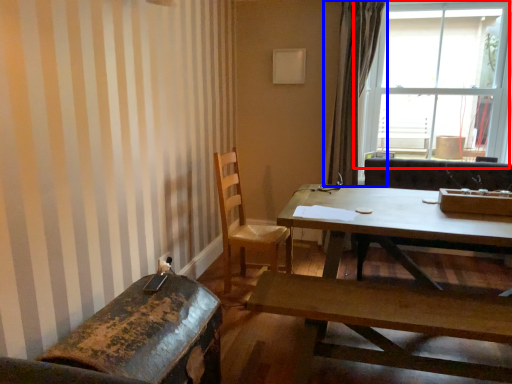
Question: Which of the following is the farthest to the observer, window (highlighted by a red box) or curtain (highlighted by a blue box)?

Choices:
 (A) window
 (B) curtain

Answer: (B)